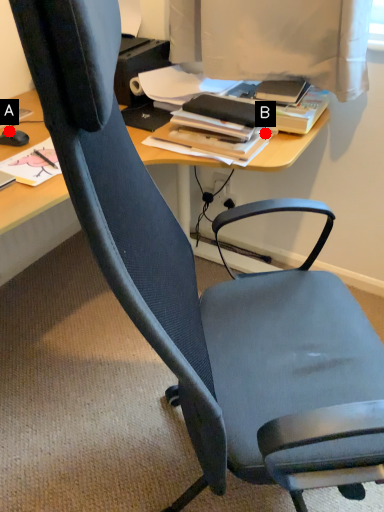
Question: Two points are circled on the image, labeled by A and B beside each circle. Which point is closer to the camera?

Choices:
 (A) A is closer
 (B) B is closer

Answer: (B)